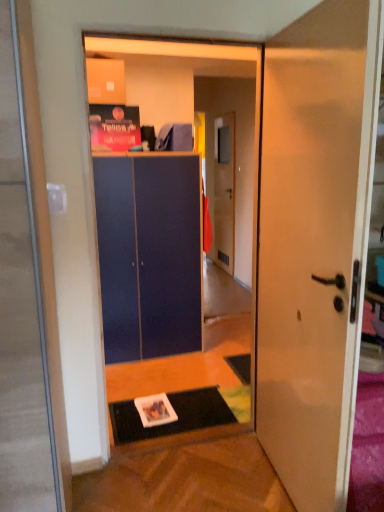
Locate an element on the screen. The width and height of the screenshot is (384, 512). empty space that is to the right of matte blue cabinet at center is located at coordinates (221, 353).